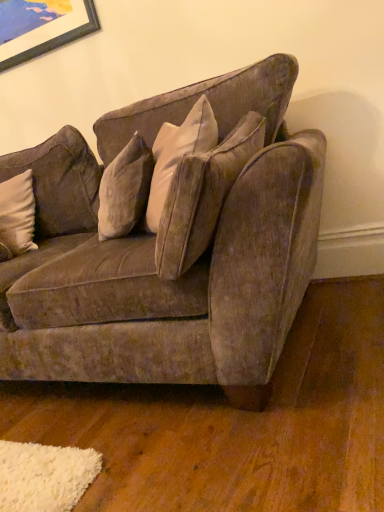
Question: Is velvet brown couch at center wider or thinner than white soft pillow at left?

Choices:
 (A) wide
 (B) thin

Answer: (A)

Question: Considering the relative positions of velvet brown couch at center and white soft pillow at left in the image provided, is velvet brown couch at center to the left or to the right of white soft pillow at left?

Choices:
 (A) right
 (B) left

Answer: (A)

Question: Is velvet brown couch at center taller or shorter than white soft pillow at left?

Choices:
 (A) tall
 (B) short

Answer: (A)

Question: Visually, is white soft pillow at left positioned to the left or to the right of velvet brown couch at center?

Choices:
 (A) right
 (B) left

Answer: (B)

Question: Is white soft pillow at left in front of or behind velvet brown couch at center in the image?

Choices:
 (A) behind
 (B) front

Answer: (A)

Question: Looking at their shapes, would you say white soft pillow at left is wider or thinner than velvet brown couch at center?

Choices:
 (A) thin
 (B) wide

Answer: (A)

Question: From the image's perspective, is white soft pillow at left above or below velvet brown couch at center?

Choices:
 (A) above
 (B) below

Answer: (A)